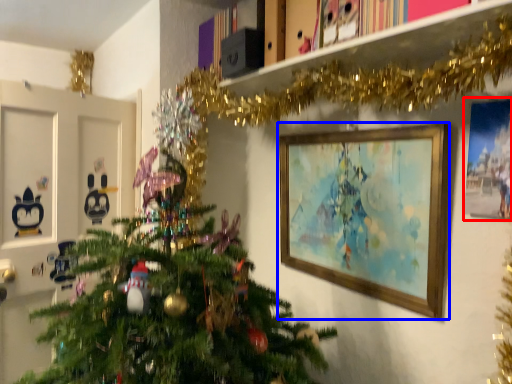
Question: Which of the following is the closest to the observer, picture frame (highlighted by a red box) or picture frame (highlighted by a blue box)?

Choices:
 (A) picture frame
 (B) picture frame

Answer: (A)